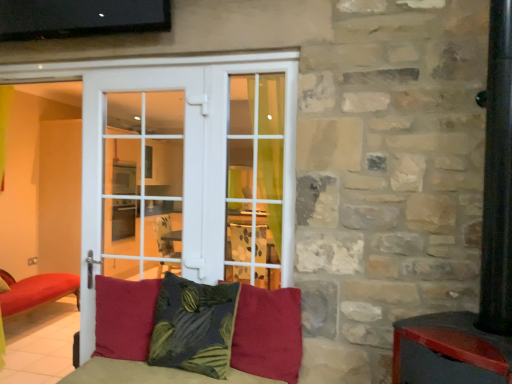
Question: Which direction should I rotate to face velvet red pillow at center, the 1th pillow when ordered from right to left, — up or down?

Choices:
 (A) up
 (B) down

Answer: (B)

Question: From the image's perspective, would you say velvet red cushion at center, acting as the 3th pillow starting from the right, is shown under velvet red pillow at center, the 3th pillow in the left-to-right sequence?

Choices:
 (A) no
 (B) yes

Answer: (B)

Question: Considering the relative positions of velvet red cushion at center, acting as the 3th pillow starting from the right, and velvet red pillow at center, the 1th pillow when ordered from right to left, in the image provided, is velvet red cushion at center, acting as the 3th pillow starting from the right, in front of velvet red pillow at center, the 1th pillow when ordered from right to left,?

Choices:
 (A) no
 (B) yes

Answer: (A)

Question: Considering the relative positions of velvet red cushion at center, which is counted as the 1th pillow, starting from the left, and velvet red pillow at center, the 3th pillow in the left-to-right sequence, in the image provided, is velvet red cushion at center, which is counted as the 1th pillow, starting from the left, to the right of velvet red pillow at center, the 3th pillow in the left-to-right sequence, from the viewer's perspective?

Choices:
 (A) yes
 (B) no

Answer: (B)

Question: Are velvet red cushion at center, which is counted as the 1th pillow, starting from the left, and velvet red pillow at center, the 3th pillow in the left-to-right sequence, beside each other?

Choices:
 (A) no
 (B) yes

Answer: (A)

Question: Considering the relative sizes of velvet red cushion at center, acting as the 3th pillow starting from the right, and velvet red pillow at center, the 1th pillow when ordered from right to left, in the image provided, is velvet red cushion at center, acting as the 3th pillow starting from the right, shorter than velvet red pillow at center, the 1th pillow when ordered from right to left,?

Choices:
 (A) yes
 (B) no

Answer: (B)

Question: Is velvet red cushion at center, acting as the 3th pillow starting from the right, to the left of velvet red pillow at center, the 1th pillow when ordered from right to left, from the viewer's perspective?

Choices:
 (A) yes
 (B) no

Answer: (A)

Question: Is dark green textured pillow at center, which is the second pillow in left-to-right order, at the back of velvet red cushion at center, which is counted as the 1th pillow, starting from the left?

Choices:
 (A) yes
 (B) no

Answer: (B)

Question: From the image's perspective, does velvet red cushion at center, which is counted as the 1th pillow, starting from the left, appear lower than dark green textured pillow at center, which is the second pillow in left-to-right order?

Choices:
 (A) yes
 (B) no

Answer: (A)

Question: Is velvet red cushion at center, which is counted as the 1th pillow, starting from the left, to the right of dark green textured pillow at center, which is the second pillow in left-to-right order, from the viewer's perspective?

Choices:
 (A) yes
 (B) no

Answer: (B)

Question: Is velvet red cushion at center, which is counted as the 1th pillow, starting from the left, closer to camera compared to dark green textured pillow at center, which is the second pillow in left-to-right order?

Choices:
 (A) yes
 (B) no

Answer: (B)

Question: From the image's perspective, does velvet red cushion at center, which is counted as the 1th pillow, starting from the left, appear higher than dark green textured pillow at center, which is the second pillow in left-to-right order?

Choices:
 (A) yes
 (B) no

Answer: (B)

Question: Considering the relative sizes of velvet red cushion at center, acting as the 3th pillow starting from the right, and dark green textured pillow at center, which is the second pillow in left-to-right order, in the image provided, is velvet red cushion at center, acting as the 3th pillow starting from the right, thinner than dark green textured pillow at center, which is the second pillow in left-to-right order,?

Choices:
 (A) yes
 (B) no

Answer: (A)

Question: Is white glass door at center at the left side of dark green textured pillow at center, the 2th pillow from the right?

Choices:
 (A) yes
 (B) no

Answer: (A)